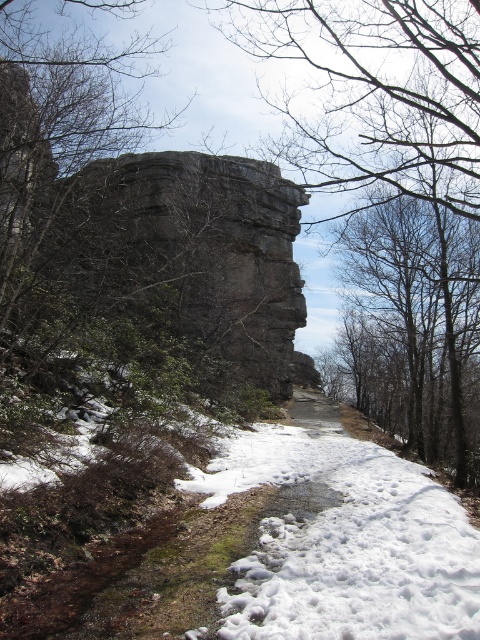
Question: Which object appears farthest from the camera in this image?

Choices:
 (A) smooth gray rock at center
 (B) white fluffy snow at center

Answer: (A)

Question: Which point is closer to the camera taking this photo?

Choices:
 (A) (472, 112)
 (B) (280, 588)

Answer: (B)

Question: Is smooth gray rock at center above white fluffy snow at center?

Choices:
 (A) no
 (B) yes

Answer: (B)

Question: Can you confirm if smooth gray rock at center is thinner than white fluffy snow at center?

Choices:
 (A) no
 (B) yes

Answer: (A)

Question: Can you confirm if smooth gray rock at center is positioned to the left of white fluffy snow at center?

Choices:
 (A) no
 (B) yes

Answer: (A)